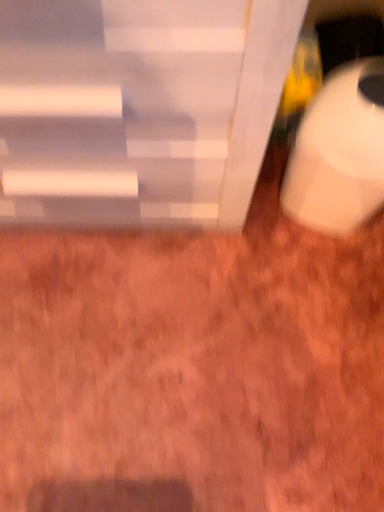
At what (x,y) coordinates should I click in order to perform the action: click on white glossy door at upper center. Please return your answer as a coordinate pair (x, y). Looking at the image, I should click on (138, 108).

What do you see at coordinates (138, 108) in the screenshot? This screenshot has height=512, width=384. I see `white glossy door at upper center` at bounding box center [138, 108].

Measure the distance between point (284,77) and camera.

Point (284,77) and camera are 26.89 inches apart from each other.

I want to click on white glossy door at upper center, so click(138, 108).